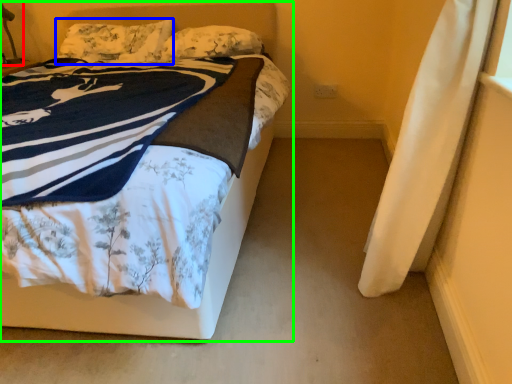
Question: Which object is positioned farthest from table lamp (highlighted by a red box)? Select from pillow (highlighted by a blue box) and bed (highlighted by a green box).

Choices:
 (A) pillow
 (B) bed

Answer: (B)